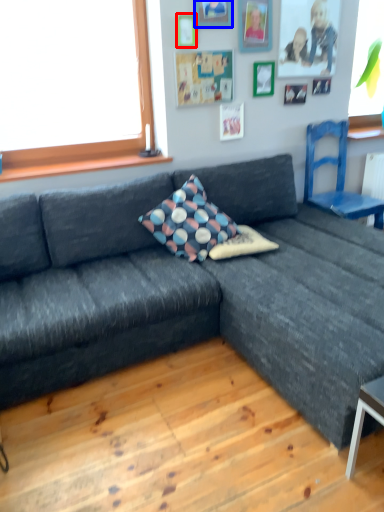
Question: Which point is further to the camera, picture frame (highlighted by a red box) or picture frame (highlighted by a blue box)?

Choices:
 (A) picture frame
 (B) picture frame

Answer: (A)